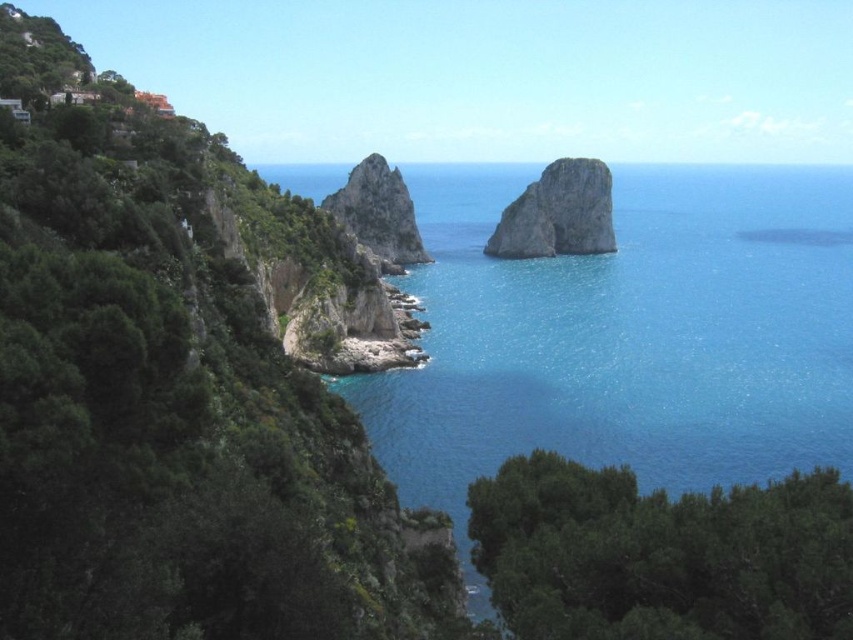
You are a hiker standing on the green leafy hillside at left. You want to reach the rough stone rock at center. Which direction should you move towards?

Since the green leafy hillside at left is in front of the rough stone rock at center, you should move towards the center of the image to reach the rock.